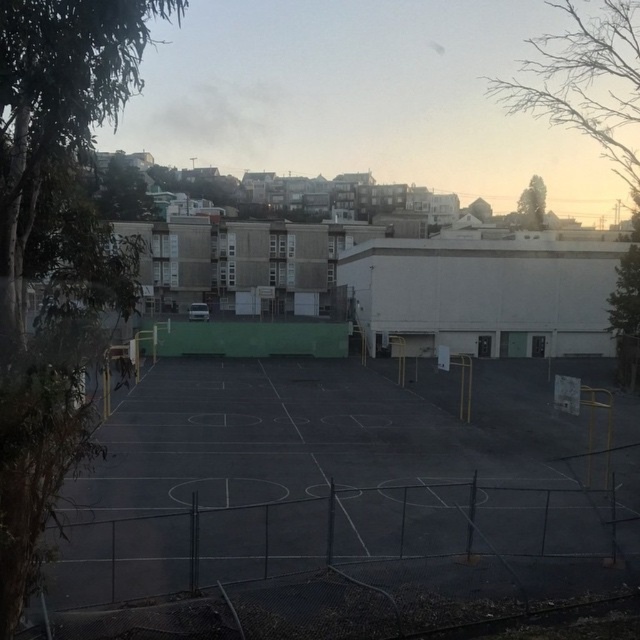
Which is above, black rubber basketball court at center or green leafy tree at left?

green leafy tree at left

Can you confirm if black rubber basketball court at center is bigger than green leafy tree at left?

No, black rubber basketball court at center is not bigger than green leafy tree at left.

Does point (76, 538) come behind point (29, 557)?

Yes, it is.

Find the location of `black rubber basketball court at center`. black rubber basketball court at center is located at coordinates [x=305, y=470].

Is green leafy tree at left positioned before bare branches at upper right?

Yes, green leafy tree at left is in front of bare branches at upper right.

Based on the photo, is green leafy tree at left shorter than bare branches at upper right?

Correct, green leafy tree at left is not as tall as bare branches at upper right.

What do you see at coordinates (54, 250) in the screenshot?
I see `green leafy tree at left` at bounding box center [54, 250].

Locate an element on the screen. The height and width of the screenshot is (640, 640). green leafy tree at left is located at coordinates pyautogui.click(x=54, y=250).

Which is in front, point (620, 173) or point (541, 221)?

Point (541, 221) is more forward.

This screenshot has width=640, height=640. What do you see at coordinates (595, 125) in the screenshot?
I see `bare branches at upper right` at bounding box center [595, 125].

Locate an element on the screen. bare branches at upper right is located at coordinates (595, 125).